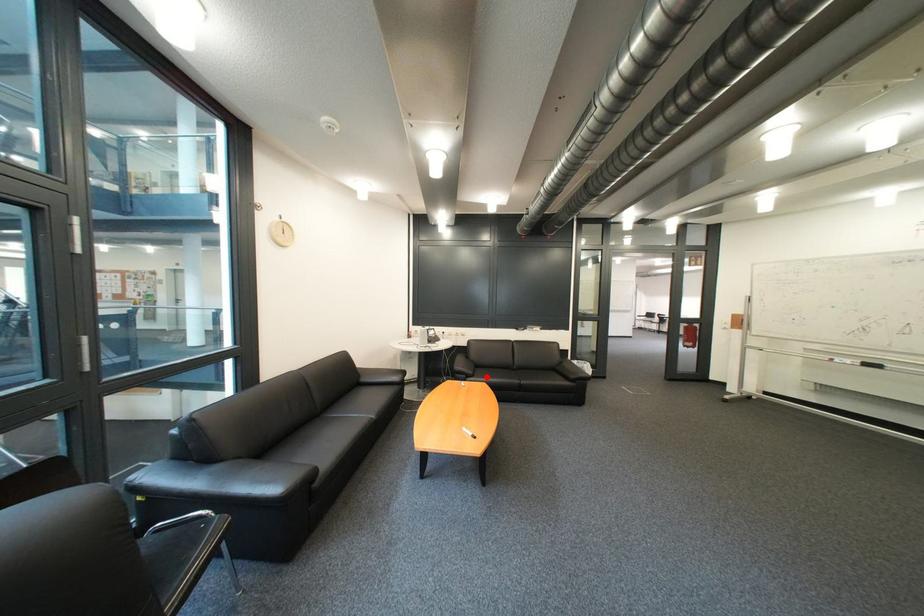
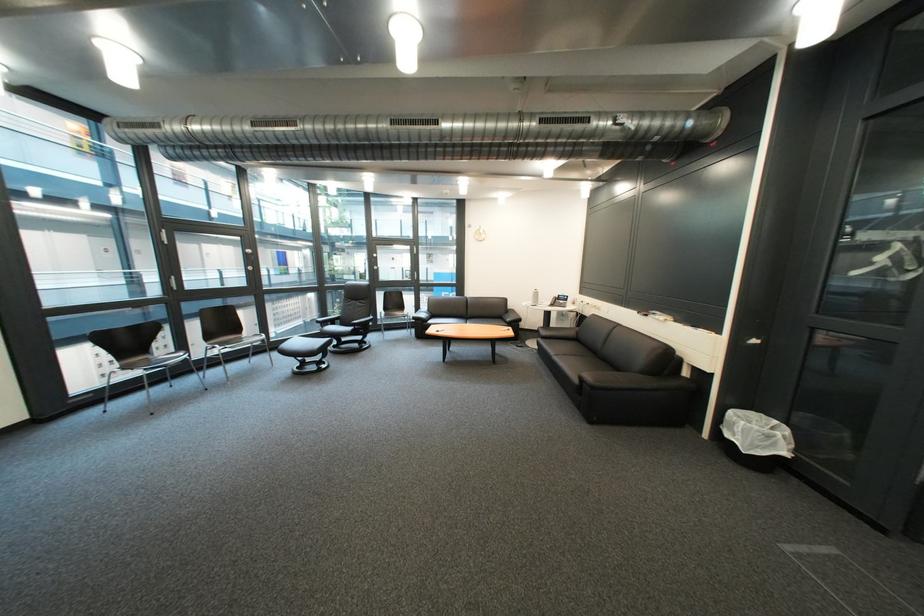
Find the pixel in the second image that matches the highlighted location in the first image.

(556, 339)